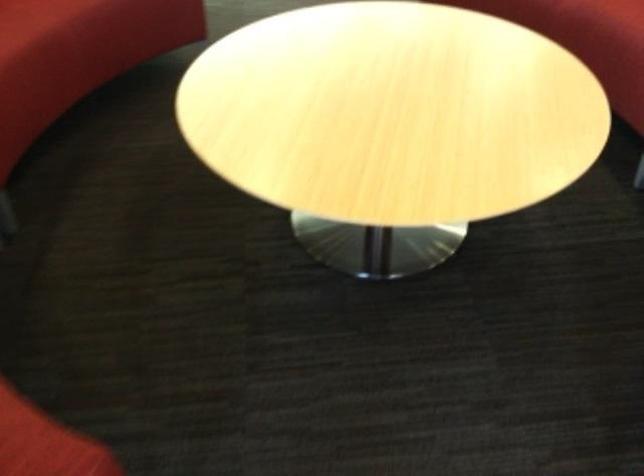
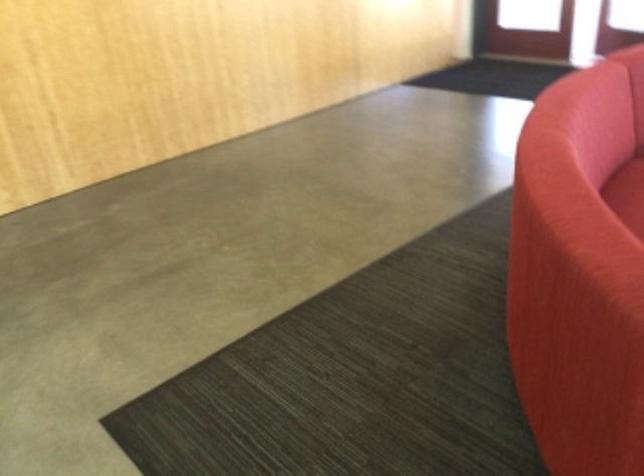
Question: In a continuous first-person perspective shot, in which direction is the camera moving?

Choices:
 (A) Left
 (B) Right
 (C) Forward
 (D) Backward

Answer: (D)